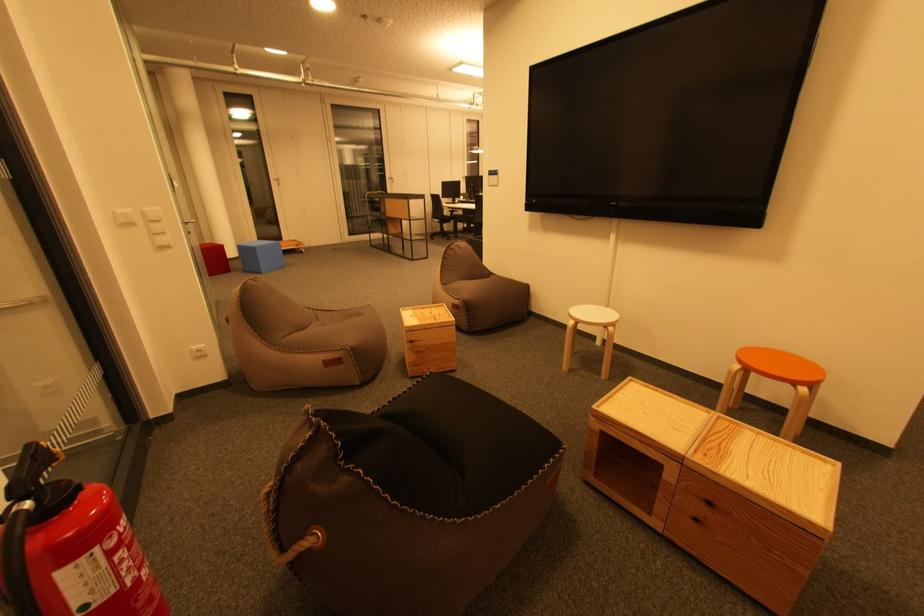
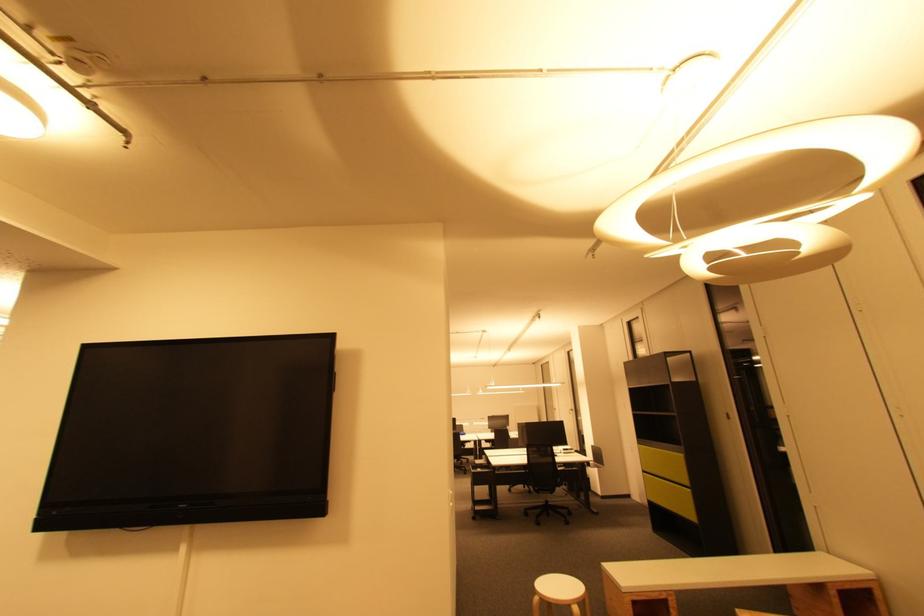
Based on the continuous images, in which direction is the camera rotating?

The camera rotated toward right-up.